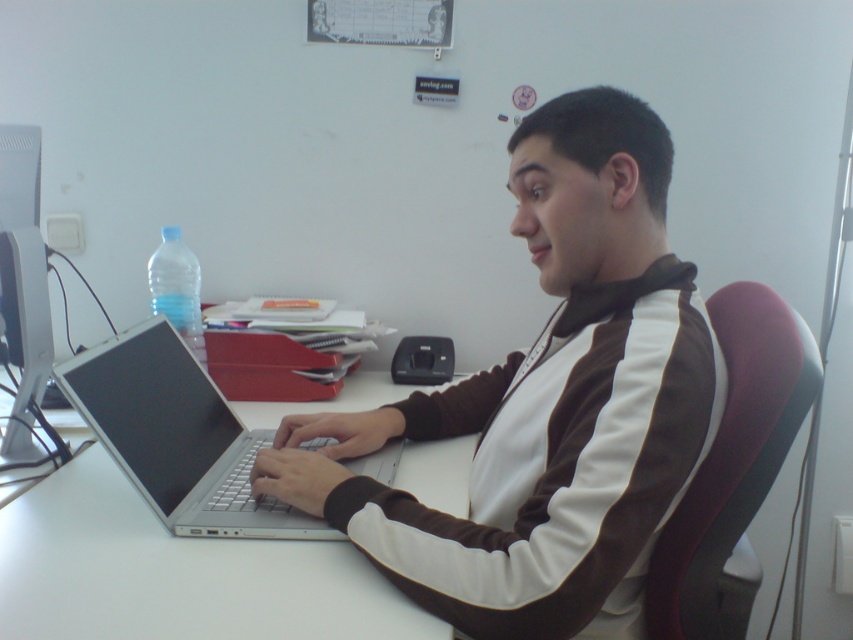
You are organizing items on a desk and need to place a new item between the white smooth jacket at center and the white glossy table at center. Where should you place it?

The white smooth jacket at center is on the right side of the white glossy table at center, so you should place the new item between them to the right of the table and left of the jacket.

You are a delivery person who needs to place a package on the desk. The package is taller than the silver metallic laptop at center. Can you place the package on the desk without it overlapping with the white smooth jacket at center?

The white smooth jacket at center is much taller than the silver metallic laptop at center. Since the package is taller than the laptop but the jacket is already taller than the laptop, the package might still be shorter than the jacket. Therefore, it is uncertain if the package can be placed without overlapping. Check the exact dimensions.